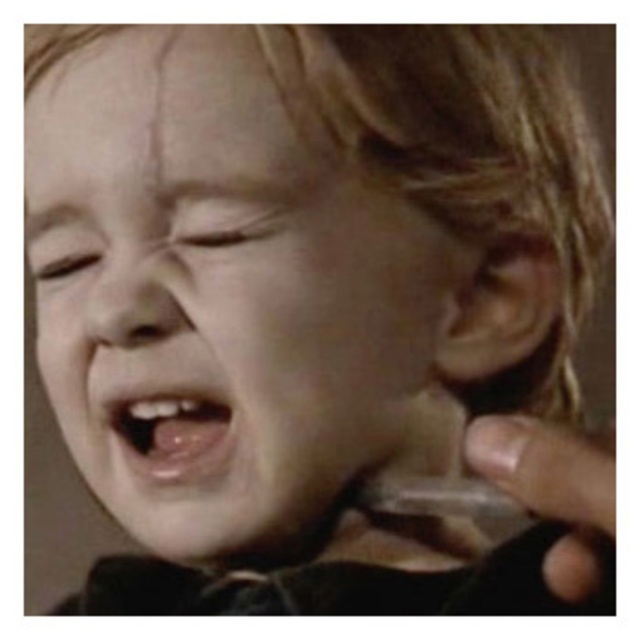
Question: Is smooth skin face at center smaller than pink glossy tongue at center?

Choices:
 (A) no
 (B) yes

Answer: (A)

Question: Which object appears farthest from the camera in this image?

Choices:
 (A) pink glossy tongue at center
 (B) smooth skin nose at center
 (C) smooth skin face at center

Answer: (A)

Question: Which point is closer to the camera?

Choices:
 (A) (186, 410)
 (B) (76, 360)

Answer: (A)

Question: Is smooth skin face at center positioned before pink glossy tongue at center?

Choices:
 (A) yes
 (B) no

Answer: (A)

Question: Is smooth skin face at center to the left of pink glossy tongue at center from the viewer's perspective?

Choices:
 (A) yes
 (B) no

Answer: (B)

Question: Which of the following is the closest to the observer?

Choices:
 (A) (234, 138)
 (B) (211, 451)

Answer: (A)